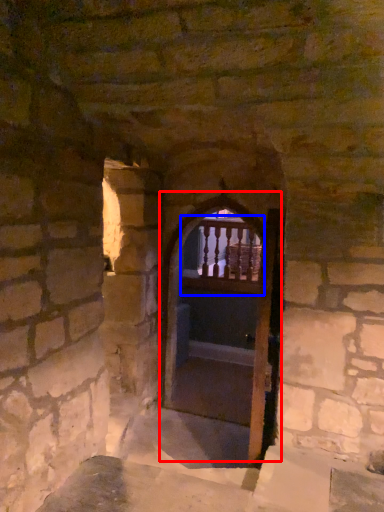
Question: Among these objects, which one is nearest to the camera, door (highlighted by a red box) or balcony (highlighted by a blue box)?

Choices:
 (A) door
 (B) balcony

Answer: (A)